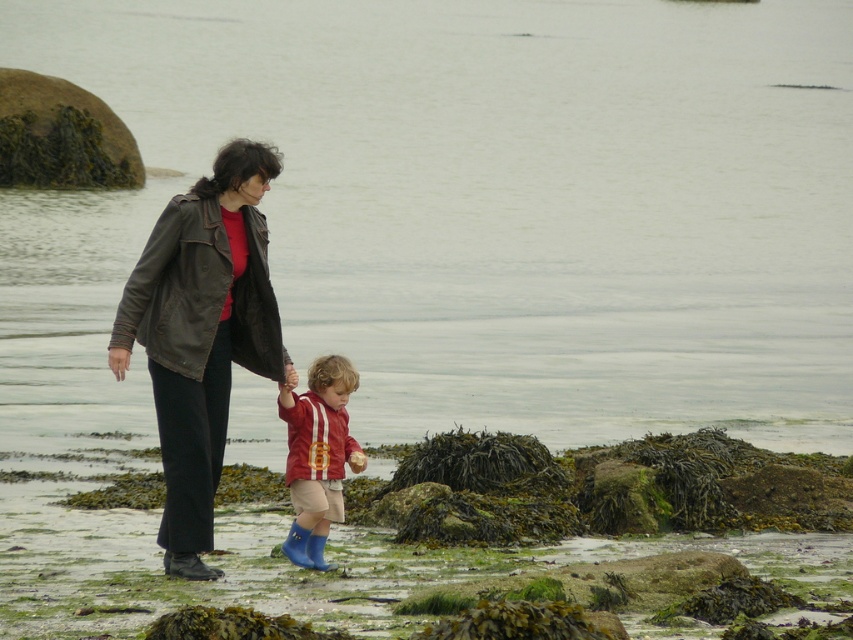
You are standing at the center of the image and want to walk to the clear water at center. In which direction should you move?

The clear water at center is already at the center point, so you are already facing it directly.

You are a photographer standing at the edge of the rocky shoreline. You see the clear water at center and the rubber blue boots at center in the scene. Which object is higher up in the image?

The clear water at center is much taller than the rubber blue boots at center, so the clear water at center is higher up in the image.

You are a photographer standing at the edge of the rocky shoreline. You want to take a photo of the leather jacket at center and the rubber blue boots at center such that both are in focus. Given that your camera can only maintain sharp focus within a 25 inch range, will you be able to capture both objects clearly in the same frame?

The leather jacket at center and rubber blue boots at center are 26.61 inches apart from each other. Since the distance between them exceeds the camera focus range of 25 inches, you will not be able to capture both objects clearly in the same frame.